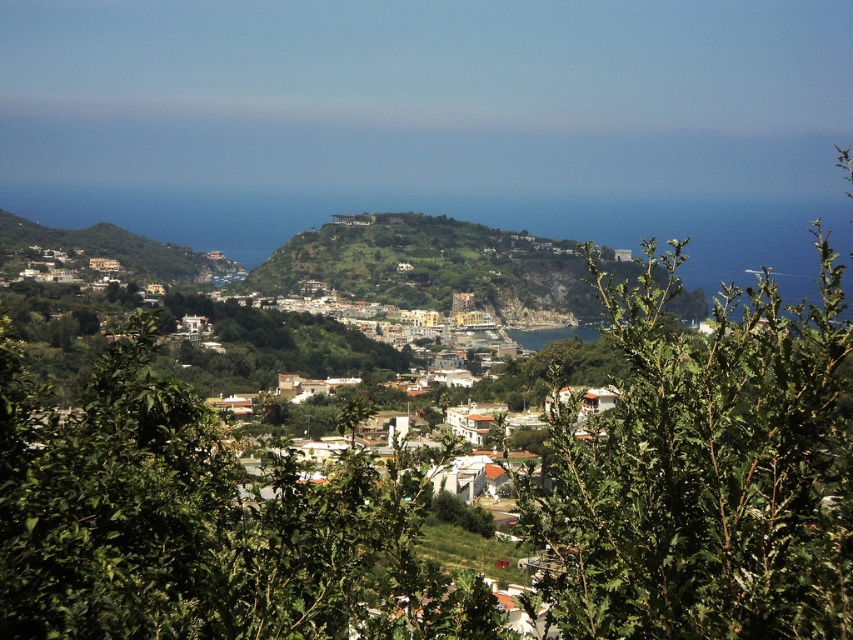
Question: Which point is closer to the camera taking this photo?

Choices:
 (A) (306, 512)
 (B) (746, 312)

Answer: (A)

Question: Which point is farther to the camera?

Choices:
 (A) green leafy bush at center
 (B) green leafy tree at center

Answer: (B)

Question: Which of the following is the closest to the observer?

Choices:
 (A) green leafy tree at center
 (B) green leafy bush at center

Answer: (B)

Question: Is green leafy bush at center wider than green leafy tree at center?

Choices:
 (A) no
 (B) yes

Answer: (A)

Question: Does green leafy bush at center appear over green leafy tree at center?

Choices:
 (A) no
 (B) yes

Answer: (B)

Question: Is green leafy bush at center behind green leafy tree at center?

Choices:
 (A) no
 (B) yes

Answer: (A)